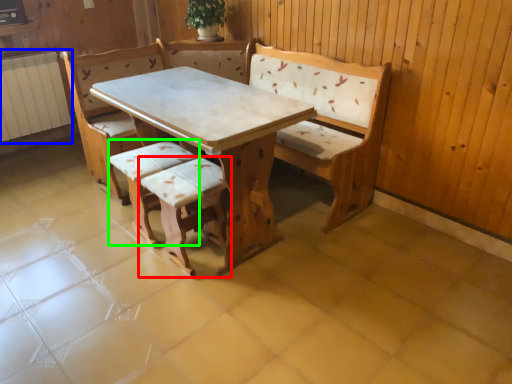
Question: Estimate the real-world distances between objects in this image. Which object is farther from armchair (highlighted by a red box), radiator (highlighted by a blue box) or armchair (highlighted by a green box)?

Choices:
 (A) radiator
 (B) armchair

Answer: (A)